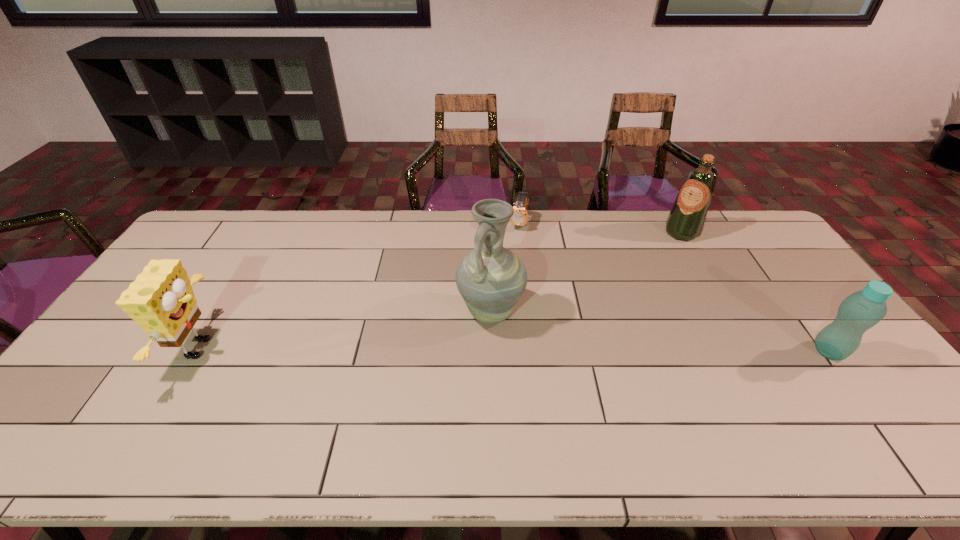
The height and width of the screenshot is (540, 960). Find the location of `sponge`. sponge is located at coordinates (161, 300).

In order to click on water bottle in this screenshot , I will do `click(860, 311)`.

The image size is (960, 540). I want to click on the shortest object, so click(520, 216).

Image resolution: width=960 pixels, height=540 pixels. What are the coordinates of `the fourth object from left to right` in the screenshot? It's located at (686, 219).

Identify the location of pitcher. Image resolution: width=960 pixels, height=540 pixels. (491, 278).

You are a GUI agent. You are given a task and a screenshot of the screen. Output one action in this format:
    pyautogui.click(x=<x>, y=<y>)
    Task: Click on the free location located 0.090m on the front-facing side of the leftmost object
    
    Given the screenshot: What is the action you would take?
    pyautogui.click(x=255, y=348)

Where is `blank space located at the front cap of the rightmost object`? The image size is (960, 540). blank space located at the front cap of the rightmost object is located at coordinates (861, 394).

Identify the location of free spot located on the face of the shortest object. (509, 254).

Where is `free space located 0.140m on the face of the shortest object`? Image resolution: width=960 pixels, height=540 pixels. free space located 0.140m on the face of the shortest object is located at coordinates (509, 256).

This screenshot has width=960, height=540. I want to click on vacant space located 0.120m on the face of the shortest object, so click(510, 253).